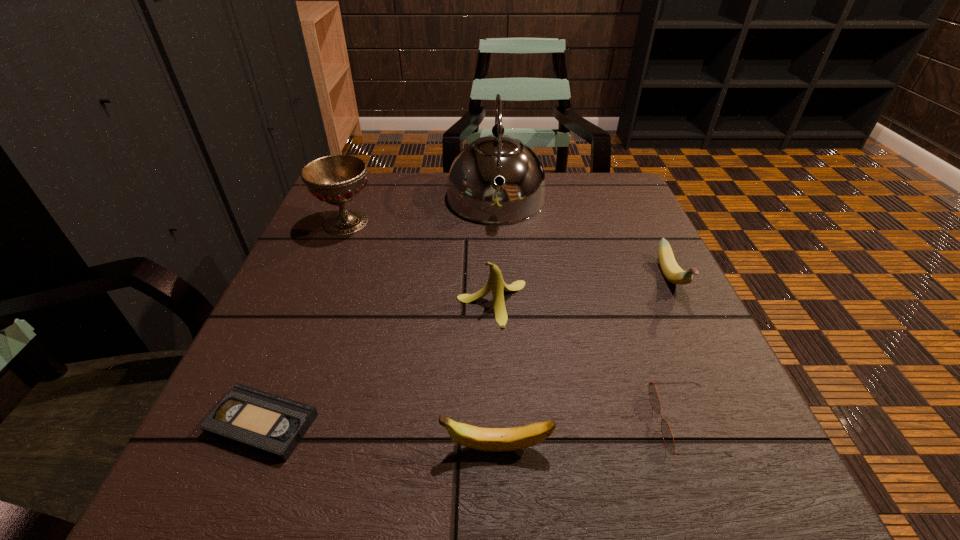
This screenshot has height=540, width=960. Identify the location of the second closest banana to the second tallest object. (484, 439).

Where is `vacant space that satisfies the following two spatial constraints: 1. at the stem of the rightmost banana; 2. at the stem of the nearest banana`? vacant space that satisfies the following two spatial constraints: 1. at the stem of the rightmost banana; 2. at the stem of the nearest banana is located at coordinates (755, 448).